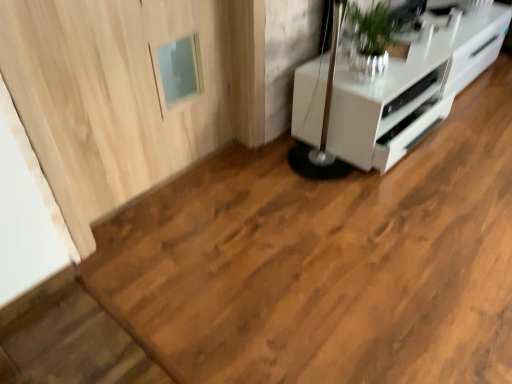
Question: Is the surface of white glossy appliance at upper right in direct contact with white glossy cabinet at upper right?

Choices:
 (A) yes
 (B) no

Answer: (B)

Question: Does white glossy appliance at upper right come in front of white glossy cabinet at upper right?

Choices:
 (A) yes
 (B) no

Answer: (B)

Question: Does white glossy appliance at upper right have a lesser width compared to white glossy cabinet at upper right?

Choices:
 (A) no
 (B) yes

Answer: (B)

Question: Does white glossy appliance at upper right have a greater width compared to white glossy cabinet at upper right?

Choices:
 (A) no
 (B) yes

Answer: (A)

Question: Is white glossy appliance at upper right bigger than white glossy cabinet at upper right?

Choices:
 (A) yes
 (B) no

Answer: (B)

Question: From a real-world perspective, is white glossy cabinet at upper right above or below green leafy plant at upper right?

Choices:
 (A) above
 (B) below

Answer: (B)

Question: In terms of width, does white glossy cabinet at upper right look wider or thinner when compared to green leafy plant at upper right?

Choices:
 (A) thin
 (B) wide

Answer: (B)

Question: Is white glossy cabinet at upper right inside the boundaries of green leafy plant at upper right, or outside?

Choices:
 (A) inside
 (B) outside

Answer: (B)

Question: Is white glossy cabinet at upper right bigger or smaller than green leafy plant at upper right?

Choices:
 (A) small
 (B) big

Answer: (B)

Question: In terms of width, does light wood door at upper left look wider or thinner when compared to green leafy plant at upper right?

Choices:
 (A) thin
 (B) wide

Answer: (A)

Question: From their relative heights in the image, would you say light wood door at upper left is taller or shorter than green leafy plant at upper right?

Choices:
 (A) tall
 (B) short

Answer: (A)

Question: From the image's perspective, is light wood door at upper left located above or below green leafy plant at upper right?

Choices:
 (A) above
 (B) below

Answer: (B)

Question: From a real-world perspective, is light wood door at upper left physically located above or below green leafy plant at upper right?

Choices:
 (A) above
 (B) below

Answer: (B)

Question: In the image, is white glossy appliance at upper right positioned in front of or behind light wood door at upper left?

Choices:
 (A) front
 (B) behind

Answer: (B)

Question: From a real-world perspective, is white glossy appliance at upper right above or below light wood door at upper left?

Choices:
 (A) above
 (B) below

Answer: (B)